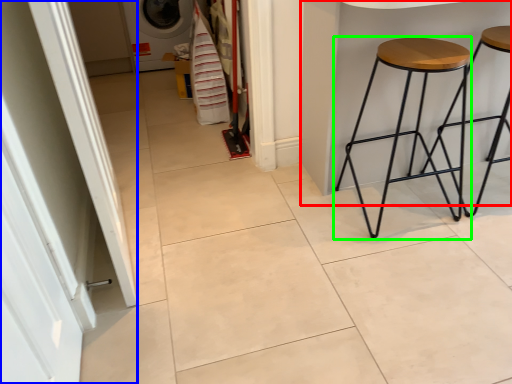
Question: Considering the real-world distances, which object is farthest from table (highlighted by a red box)? screen door (highlighted by a blue box) or stool (highlighted by a green box)?

Choices:
 (A) screen door
 (B) stool

Answer: (A)